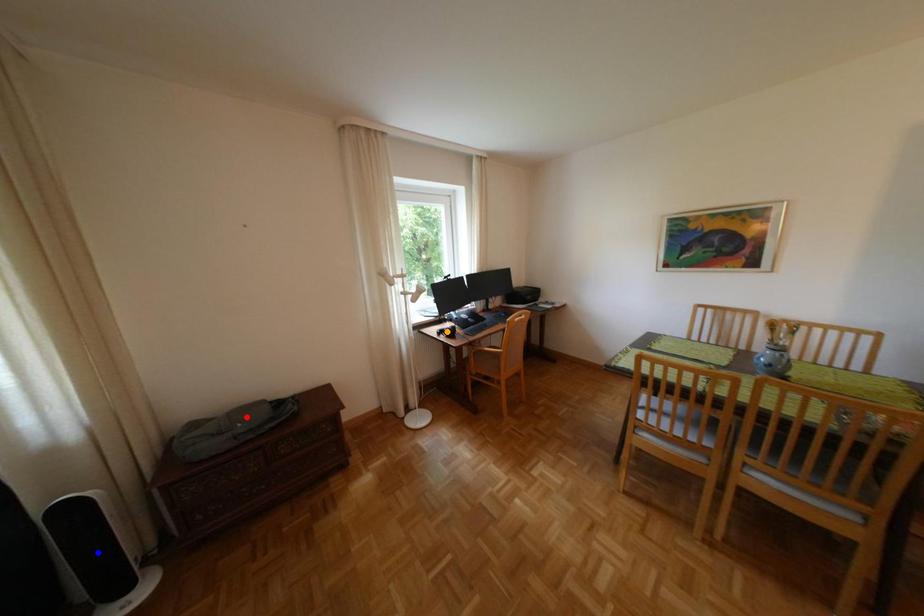
Order these from nearest to farthest:
1. red point
2. blue point
3. orange point

1. blue point
2. red point
3. orange point